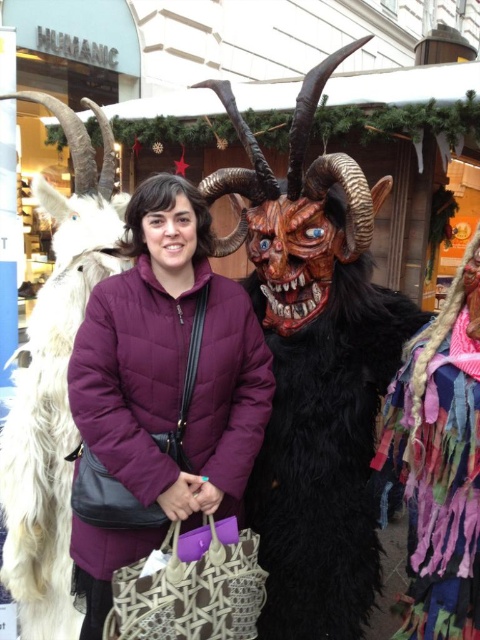
In the image of the Christmas market, there is a person wearing a purple quilted jacket at center and a Krampus costume to their right. If you were standing at the point marked as [160,394], which object would you be closest to?

The point marked as [160,394] corresponds to the purple quilted jacket at center, so you would be closest to the purple quilted jacket at center.

You are at the Christmas market and want to find the booth named HUMANIC. You see a purple quilted jacket at center and a white fur goat at left. Which object is closer to the booth sign?

The white fur goat at left is closer to the booth sign because the purple quilted jacket at center is to the right of the white fur goat at left, meaning the goat is positioned nearer to the left side where the booth sign is located.